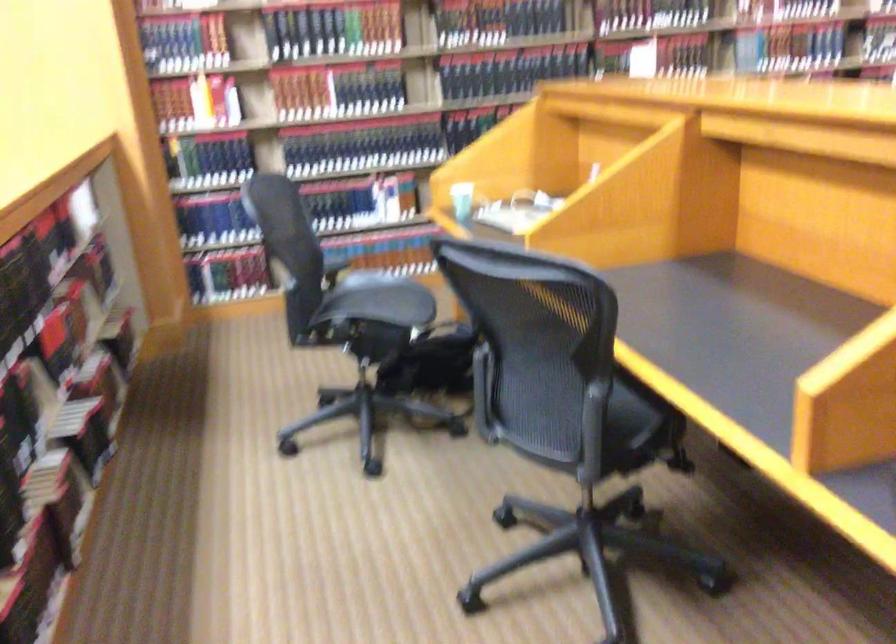
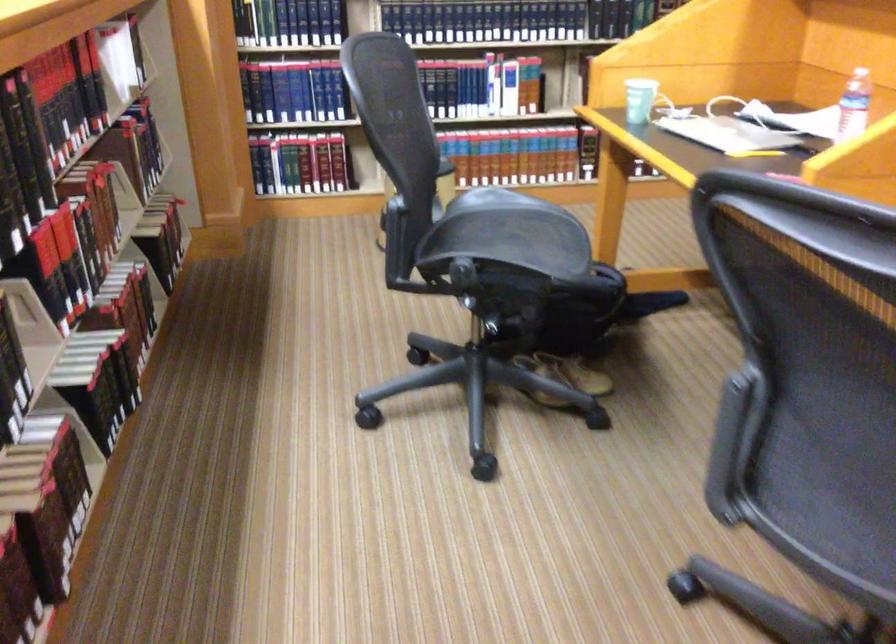
In the second image, find the point that corresponds to [371,294] in the first image.

(500, 221)